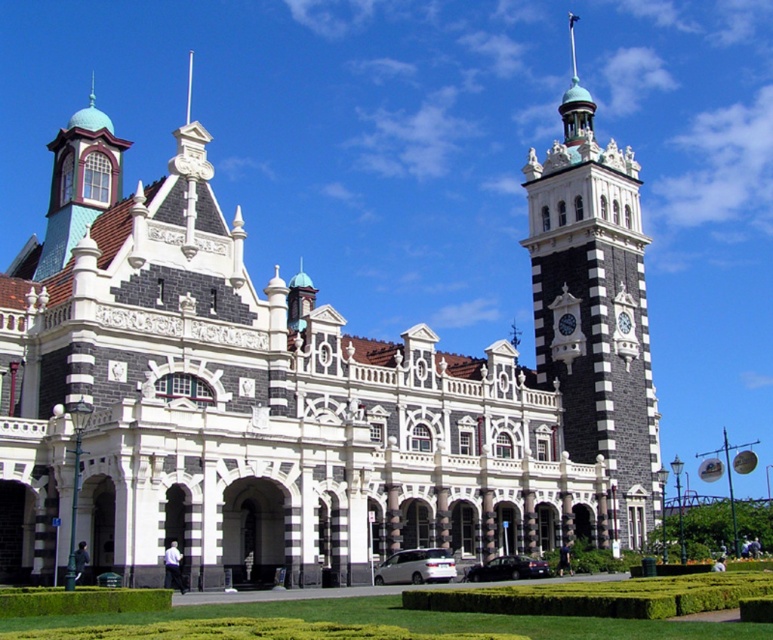
Which of these two, dark gray stone clock tower at upper right or white matte van at center, stands taller?

With more height is dark gray stone clock tower at upper right.

Is dark gray stone clock tower at upper right shorter than white matte van at center?

No.

Describe the element at coordinates (594, 307) in the screenshot. I see `dark gray stone clock tower at upper right` at that location.

Where is `dark gray stone clock tower at upper right`? dark gray stone clock tower at upper right is located at coordinates (594, 307).

Based on the photo, can you confirm if white stone building at center is positioned to the right of black glossy sedan at center?

Incorrect, white stone building at center is not on the right side of black glossy sedan at center.

Does point (2, 436) lie behind point (506, 557)?

No, (2, 436) is in front of (506, 557).

Identify the location of white stone building at center. (250, 404).

In the scene shown: Does black glossy sedan at center have a lesser width compared to polished brass clock at center-right?

Correct, black glossy sedan at center's width is less than polished brass clock at center-right's.

Does point (504, 573) come in front of point (564, 323)?

Yes, it is.

Locate an element on the screen. The width and height of the screenshot is (773, 640). black glossy sedan at center is located at coordinates (506, 568).